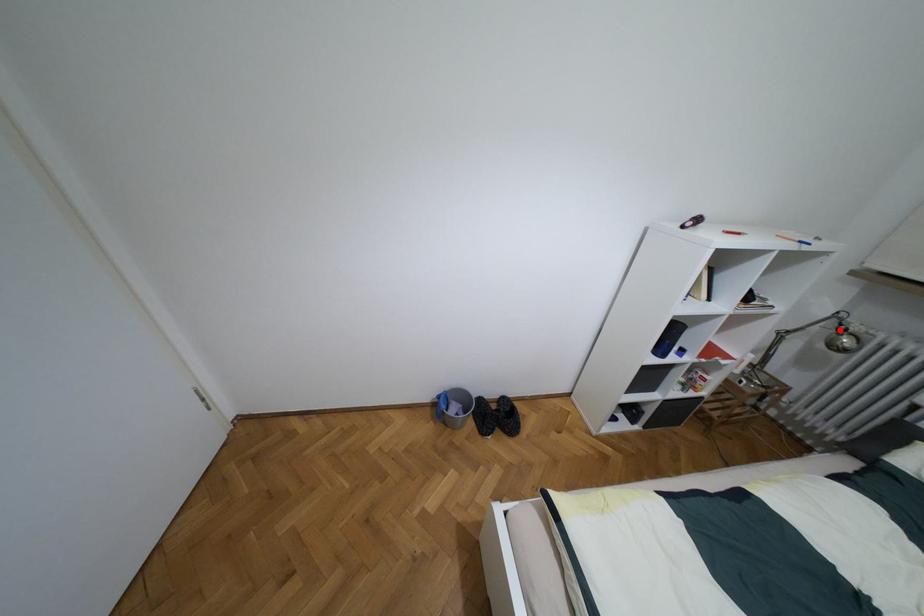
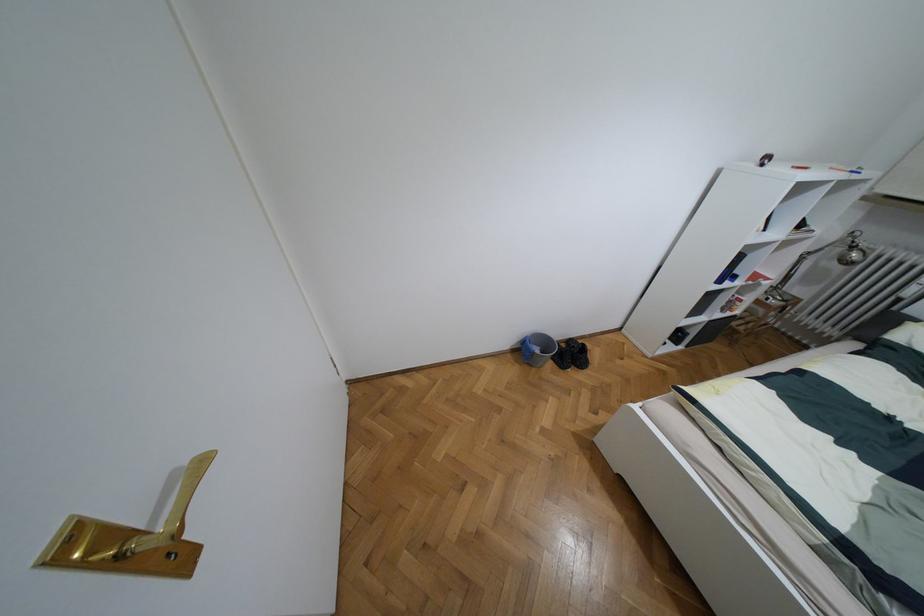
Question: I am providing you with two images of the same scene from different viewpoints. Image1 has a red point marked. In image2, the corresponding 3D location appears at what relative position? Reply with the corresponding letter.

Choices:
 (A) Closer
 (B) Farther

Answer: (B)